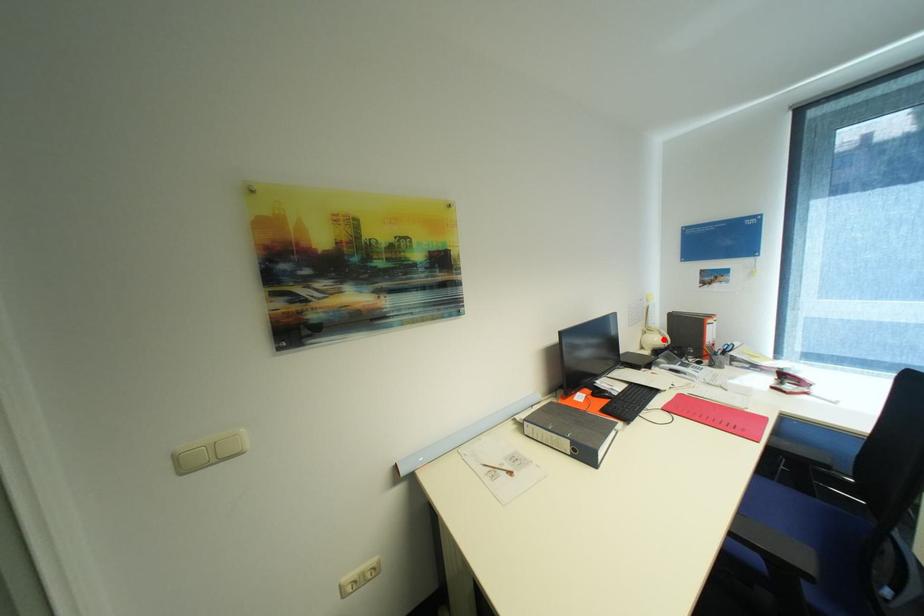
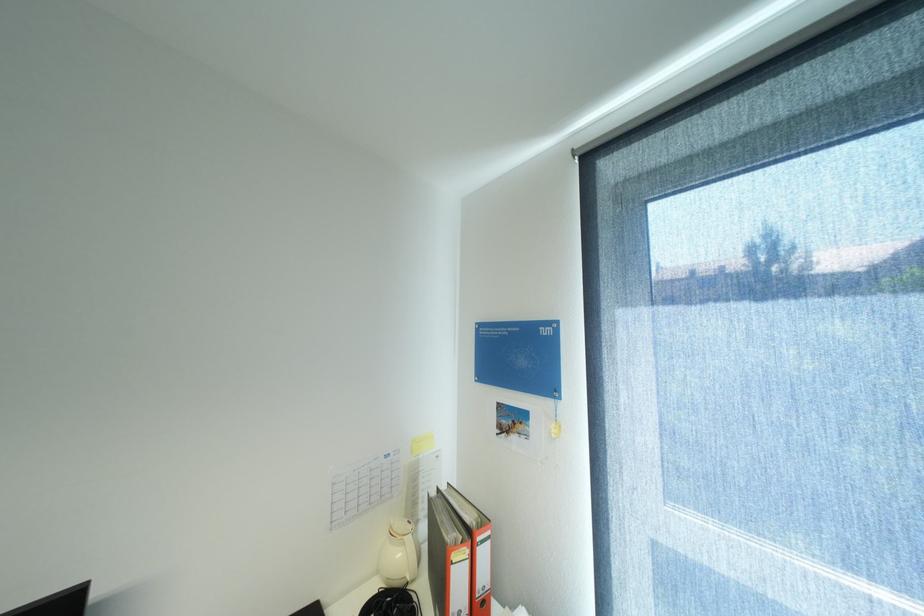
The point at the highlighted location is marked in the first image. Where is the corresponding point in the second image?

(407, 554)